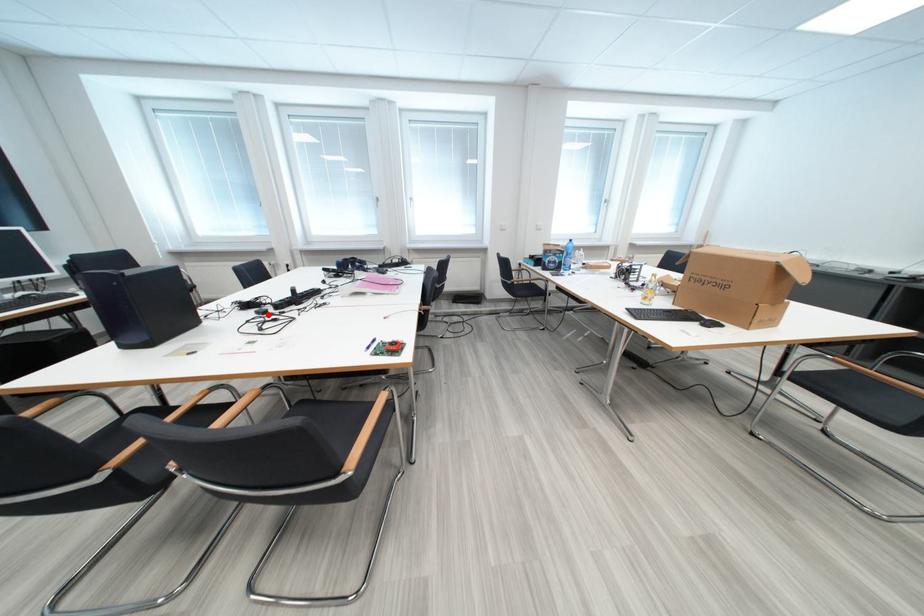
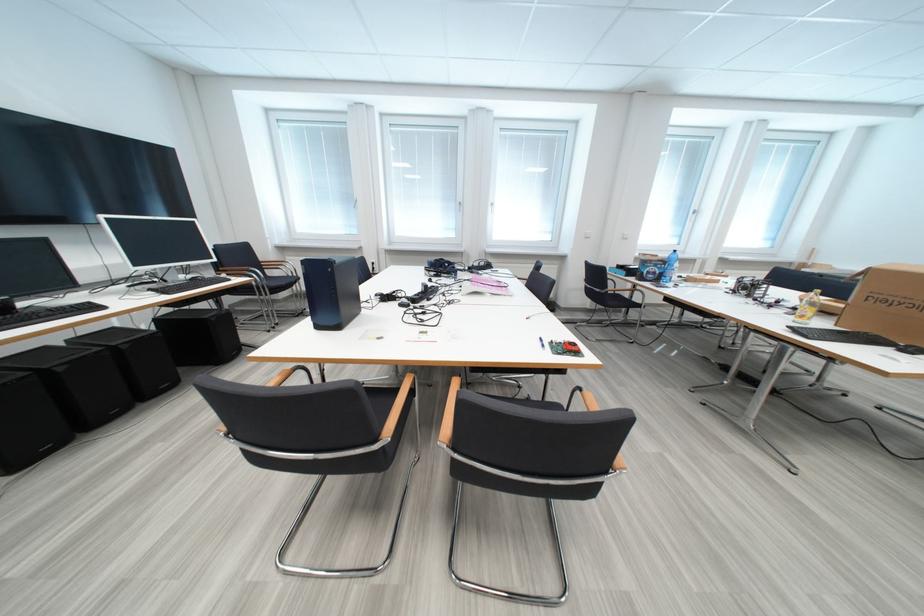
Locate, in the second image, the point that corresponds to the highlighted location in the first image.

(411, 307)